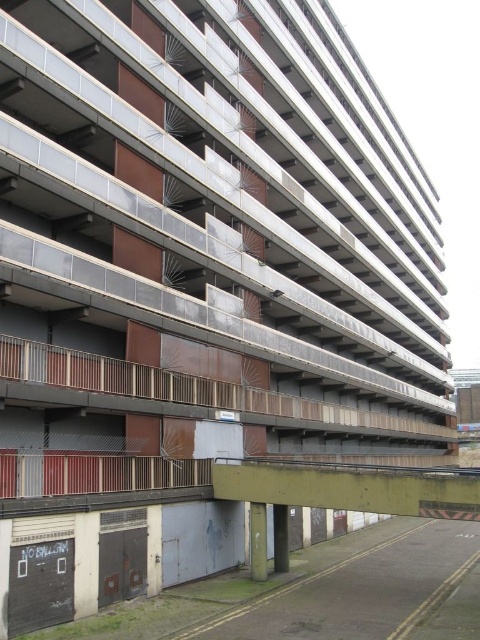
Is brown wooden balcony at lower left below concrete bridge at lower center?

No, brown wooden balcony at lower left is not below concrete bridge at lower center.

Can you confirm if brown wooden balcony at lower left is smaller than concrete bridge at lower center?

Incorrect, brown wooden balcony at lower left is not smaller in size than concrete bridge at lower center.

At what (x,y) coordinates should I click in order to perform the action: click on brown wooden balcony at lower left. Please return your answer as a coordinate pair (x, y). The image size is (480, 640). Looking at the image, I should click on (187, 388).